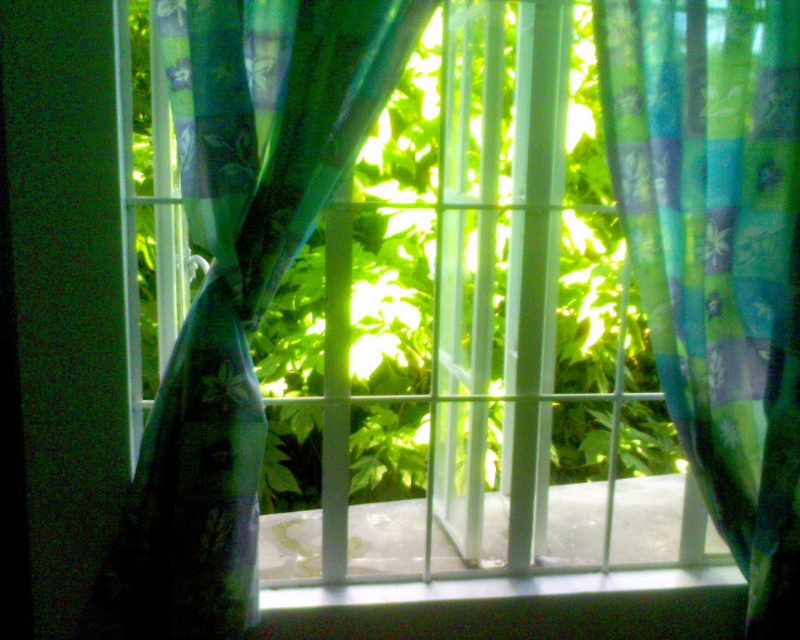
Question: Does translucent floral fabric at center come in front of white smooth concrete at center?

Choices:
 (A) yes
 (B) no

Answer: (A)

Question: Which point is closer to the camera taking this photo?

Choices:
 (A) (434, 548)
 (B) (642, 32)

Answer: (B)

Question: Which object is positioned closest to the translucent floral-patterned curtain at right?

Choices:
 (A) translucent floral fabric at center
 (B) white smooth concrete at center

Answer: (B)

Question: Where is translucent floral-patterned curtain at right located in relation to white smooth concrete at center in the image?

Choices:
 (A) right
 (B) left

Answer: (A)

Question: Does translucent floral-patterned curtain at right appear under white smooth concrete at center?

Choices:
 (A) no
 (B) yes

Answer: (A)

Question: Which of the following is the closest to the observer?

Choices:
 (A) translucent floral fabric at center
 (B) translucent floral-patterned curtain at right
 (C) white smooth concrete at center

Answer: (A)